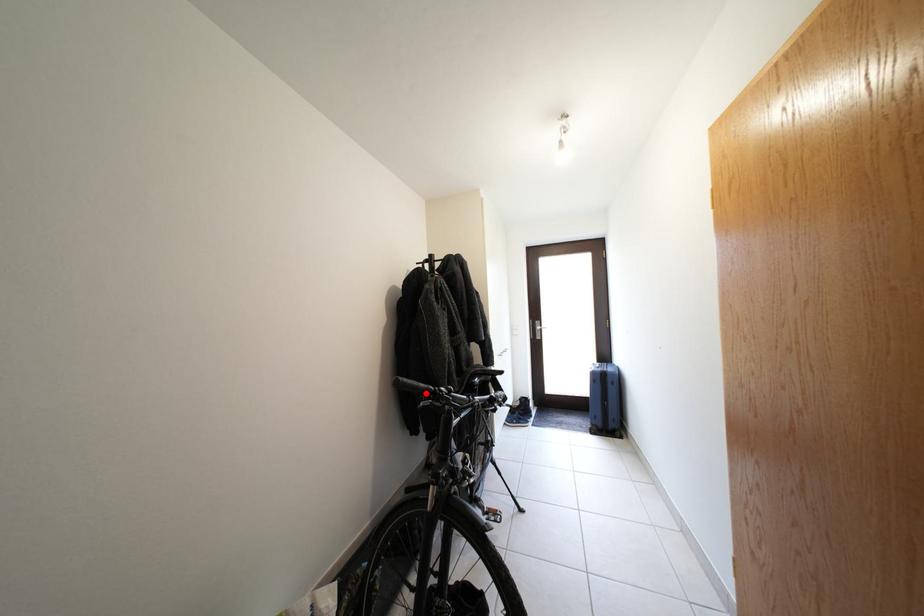
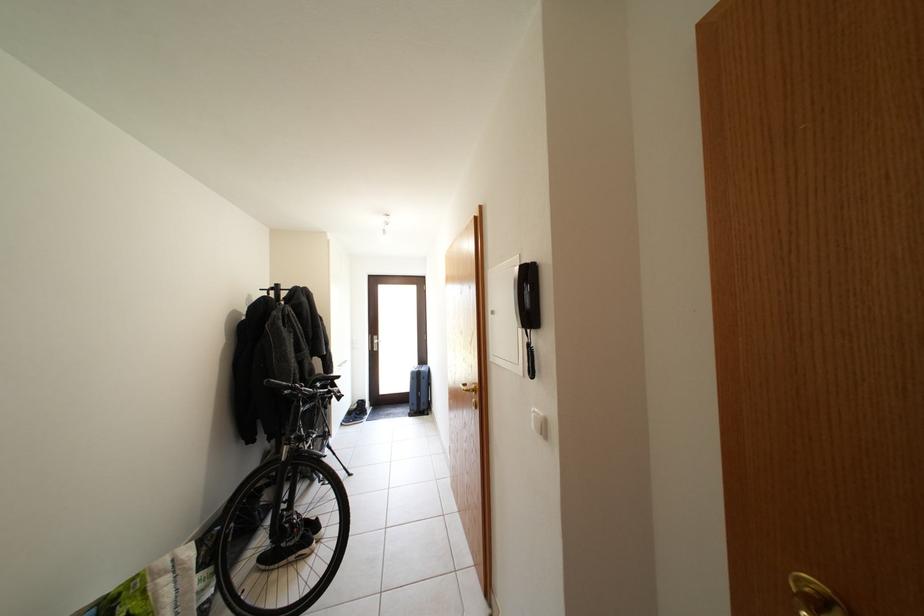
Question: I am providing you with two images of the same scene from different viewpoints. A red point is marked on the first image. At the location where the point appears in image 1, is it still visible in image 2?

Choices:
 (A) Yes
 (B) No

Answer: (A)